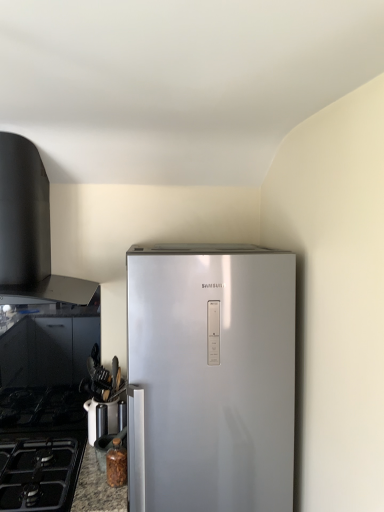
Question: Is metallic silver knife block at lower left outside black matte gas stove at lower left?

Choices:
 (A) no
 (B) yes

Answer: (B)

Question: Is there a large distance between metallic silver knife block at lower left and black matte gas stove at lower left?

Choices:
 (A) yes
 (B) no

Answer: (B)

Question: Is metallic silver knife block at lower left wider than black matte gas stove at lower left?

Choices:
 (A) yes
 (B) no

Answer: (B)

Question: Is metallic silver knife block at lower left positioned before black matte gas stove at lower left?

Choices:
 (A) yes
 (B) no

Answer: (B)

Question: Is metallic silver knife block at lower left smaller than black matte gas stove at lower left?

Choices:
 (A) yes
 (B) no

Answer: (A)

Question: Is metallic silver knife block at lower left oriented away from black matte gas stove at lower left?

Choices:
 (A) no
 (B) yes

Answer: (A)

Question: Could metallic silver knife block at lower left be considered to be inside black matte vent at upper left?

Choices:
 (A) no
 (B) yes

Answer: (A)

Question: From a real-world perspective, is black matte vent at upper left below metallic silver knife block at lower left?

Choices:
 (A) no
 (B) yes

Answer: (A)

Question: From the image's perspective, is black matte vent at upper left on metallic silver knife block at lower left?

Choices:
 (A) no
 (B) yes

Answer: (B)

Question: Could you tell me if black matte vent at upper left is facing metallic silver knife block at lower left?

Choices:
 (A) no
 (B) yes

Answer: (A)

Question: Is black matte vent at upper left wider than metallic silver knife block at lower left?

Choices:
 (A) no
 (B) yes

Answer: (B)

Question: Considering the relative sizes of black matte vent at upper left and metallic silver knife block at lower left in the image provided, is black matte vent at upper left bigger than metallic silver knife block at lower left?

Choices:
 (A) yes
 (B) no

Answer: (A)

Question: Considering the relative sizes of granite countertop at lower left and metallic silver knife block at lower left in the image provided, is granite countertop at lower left taller than metallic silver knife block at lower left?

Choices:
 (A) yes
 (B) no

Answer: (A)